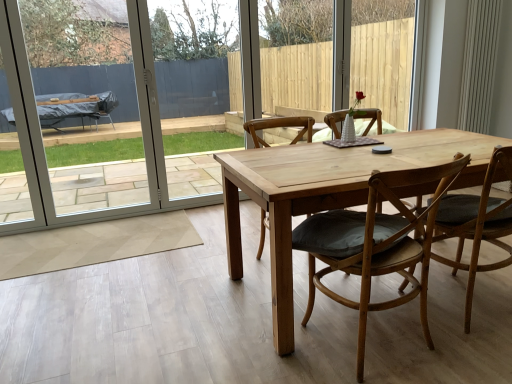
Question: Considering the relative sizes of light brown wooden chair at center, which ranks as the 1th chair in left-to-right order, and wooden chair with cushion at center, placed as the 2th chair when sorted from left to right, in the image provided, is light brown wooden chair at center, which ranks as the 1th chair in left-to-right order, smaller than wooden chair with cushion at center, placed as the 2th chair when sorted from left to right,?

Choices:
 (A) yes
 (B) no

Answer: (A)

Question: Is the depth of light brown wooden chair at center, which ranks as the 1th chair in left-to-right order, greater than that of wooden chair with cushion at center, placed as the 2th chair when sorted from left to right?

Choices:
 (A) yes
 (B) no

Answer: (A)

Question: Is light brown wooden chair at center, which ranks as the 1th chair in left-to-right order, turned away from wooden chair with cushion at center, the second chair from the right?

Choices:
 (A) no
 (B) yes

Answer: (A)

Question: Considering the relative positions of light brown wooden chair at center, placed as the third chair when sorted from right to left, and wooden chair with cushion at center, placed as the 2th chair when sorted from left to right, in the image provided, is light brown wooden chair at center, placed as the third chair when sorted from right to left, to the left of wooden chair with cushion at center, placed as the 2th chair when sorted from left to right, from the viewer's perspective?

Choices:
 (A) yes
 (B) no

Answer: (A)

Question: Can you confirm if light brown wooden chair at center, which ranks as the 1th chair in left-to-right order, is taller than wooden chair with cushion at center, placed as the 2th chair when sorted from left to right?

Choices:
 (A) yes
 (B) no

Answer: (A)

Question: Relative to light brown wooden chair at center, which is counted as the 1th chair, starting from the right, is light brown wooden chair at center, which ranks as the 1th chair in left-to-right order, in front or behind?

Choices:
 (A) front
 (B) behind

Answer: (B)

Question: From a real-world perspective, is light brown wooden chair at center, placed as the third chair when sorted from right to left, above or below light brown wooden chair at center, which is counted as the 1th chair, starting from the right?

Choices:
 (A) above
 (B) below

Answer: (B)

Question: Considering the positions of light brown wooden chair at center, placed as the third chair when sorted from right to left, and light brown wooden chair at center, which is counted as the 1th chair, starting from the right, in the image, is light brown wooden chair at center, placed as the third chair when sorted from right to left, wider or thinner than light brown wooden chair at center, which is counted as the 1th chair, starting from the right,?

Choices:
 (A) thin
 (B) wide

Answer: (A)

Question: From the image's perspective, is light brown wooden chair at center, which ranks as the 1th chair in left-to-right order, above or below light brown wooden chair at center, which is counted as the 1th chair, starting from the right?

Choices:
 (A) above
 (B) below

Answer: (A)

Question: Looking at the image, does white plastic screen door at left seem bigger or smaller compared to light brown wooden chair at center, arranged as the third chair when viewed from the left?

Choices:
 (A) big
 (B) small

Answer: (B)

Question: Is white plastic screen door at left to the left or to the right of light brown wooden chair at center, which is counted as the 1th chair, starting from the right, in the image?

Choices:
 (A) left
 (B) right

Answer: (A)

Question: Considering their positions, is white plastic screen door at left located in front of or behind light brown wooden chair at center, which is counted as the 1th chair, starting from the right?

Choices:
 (A) behind
 (B) front

Answer: (A)

Question: Is point (89, 16) positioned closer to the camera than point (436, 233)?

Choices:
 (A) closer
 (B) farther

Answer: (B)

Question: From the image's perspective, is white plastic screen door at left above or below light brown wooden chair at center, which ranks as the 1th chair in left-to-right order?

Choices:
 (A) above
 (B) below

Answer: (A)

Question: Would you say white plastic screen door at left is inside or outside light brown wooden chair at center, which ranks as the 1th chair in left-to-right order?

Choices:
 (A) outside
 (B) inside

Answer: (A)